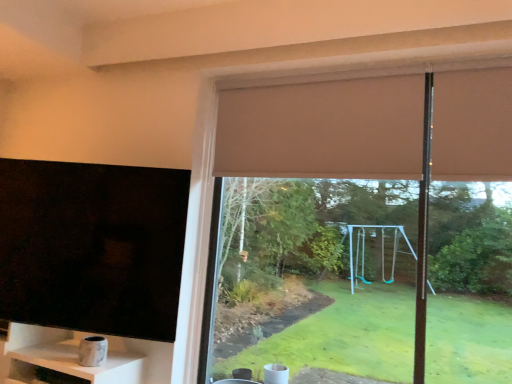
Question: Considering the relative sizes of beige fabric curtain at upper center and black matte tv at left in the image provided, is beige fabric curtain at upper center wider than black matte tv at left?

Choices:
 (A) yes
 (B) no

Answer: (B)

Question: Is beige fabric curtain at upper center oriented towards black matte tv at left?

Choices:
 (A) no
 (B) yes

Answer: (A)

Question: Does beige fabric curtain at upper center have a smaller size compared to black matte tv at left?

Choices:
 (A) no
 (B) yes

Answer: (B)

Question: Is beige fabric curtain at upper center at the left side of black matte tv at left?

Choices:
 (A) yes
 (B) no

Answer: (B)

Question: Is beige fabric curtain at upper center oriented away from black matte tv at left?

Choices:
 (A) no
 (B) yes

Answer: (A)

Question: Is black matte tv at left in front of or behind marble-like white shelf at lower left in the image?

Choices:
 (A) front
 (B) behind

Answer: (B)

Question: Which is correct: black matte tv at left is inside marble-like white shelf at lower left, or outside of it?

Choices:
 (A) outside
 (B) inside

Answer: (A)

Question: From a real-world perspective, is black matte tv at left physically located above or below marble-like white shelf at lower left?

Choices:
 (A) below
 (B) above

Answer: (B)

Question: From the image's perspective, is black matte tv at left above or below marble-like white shelf at lower left?

Choices:
 (A) below
 (B) above

Answer: (B)

Question: Considering their positions, is black matte tv at left located in front of or behind beige fabric curtain at upper center?

Choices:
 (A) front
 (B) behind

Answer: (A)

Question: Considering the positions of black matte tv at left and beige fabric curtain at upper center in the image, is black matte tv at left bigger or smaller than beige fabric curtain at upper center?

Choices:
 (A) small
 (B) big

Answer: (B)

Question: From a real-world perspective, is black matte tv at left physically located above or below beige fabric curtain at upper center?

Choices:
 (A) above
 (B) below

Answer: (B)

Question: Considering the relative positions of black matte tv at left and beige fabric curtain at upper center in the image provided, is black matte tv at left to the left or to the right of beige fabric curtain at upper center?

Choices:
 (A) left
 (B) right

Answer: (A)

Question: Is beige fabric curtain at upper center wider or thinner than marble-like white shelf at lower left?

Choices:
 (A) wide
 (B) thin

Answer: (B)

Question: From a real-world perspective, is beige fabric curtain at upper center positioned above or below marble-like white shelf at lower left?

Choices:
 (A) above
 (B) below

Answer: (A)